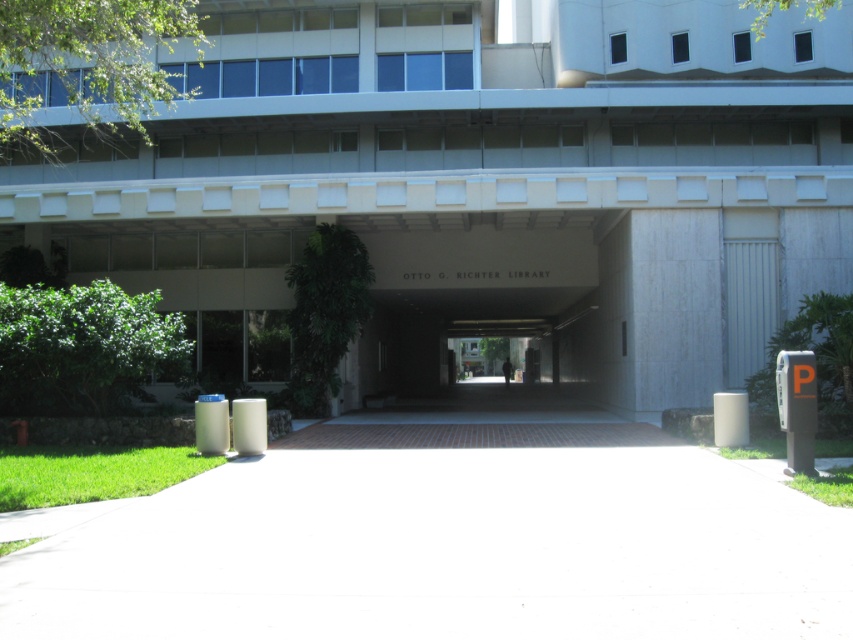
What do you see at coordinates (479, 182) in the screenshot?
I see `white concrete parking garage at center` at bounding box center [479, 182].

Who is more forward, (259, 54) or (531, 605)?

Point (531, 605) is in front.

This screenshot has width=853, height=640. What are the coordinates of `white concrete parking garage at center` in the screenshot? It's located at (479, 182).